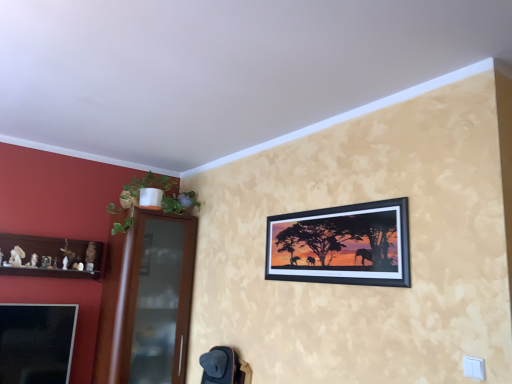
Question: Is brown glass door at left at the right side of wooden shelf at left?

Choices:
 (A) no
 (B) yes

Answer: (B)

Question: Can you confirm if brown glass door at left is positioned to the left of wooden shelf at left?

Choices:
 (A) yes
 (B) no

Answer: (B)

Question: Is brown glass door at left next to wooden shelf at left?

Choices:
 (A) no
 (B) yes

Answer: (A)

Question: Is brown glass door at left bigger than wooden shelf at left?

Choices:
 (A) yes
 (B) no

Answer: (A)

Question: From the image's perspective, is brown glass door at left over wooden shelf at left?

Choices:
 (A) yes
 (B) no

Answer: (B)

Question: Considering the relative sizes of brown glass door at left and wooden shelf at left in the image provided, is brown glass door at left wider than wooden shelf at left?

Choices:
 (A) no
 (B) yes

Answer: (B)

Question: Considering the relative positions of green leafy plant at left and wooden shelf at left in the image provided, is green leafy plant at left to the left of wooden shelf at left from the viewer's perspective?

Choices:
 (A) no
 (B) yes

Answer: (A)

Question: Is the surface of green leafy plant at left in direct contact with wooden shelf at left?

Choices:
 (A) no
 (B) yes

Answer: (A)

Question: Is the depth of green leafy plant at left greater than that of wooden shelf at left?

Choices:
 (A) no
 (B) yes

Answer: (B)

Question: Considering the relative sizes of green leafy plant at left and wooden shelf at left in the image provided, is green leafy plant at left bigger than wooden shelf at left?

Choices:
 (A) no
 (B) yes

Answer: (B)

Question: Would you say wooden shelf at left is part of green leafy plant at left's contents?

Choices:
 (A) no
 (B) yes

Answer: (A)

Question: Is green leafy plant at left aimed at wooden shelf at left?

Choices:
 (A) yes
 (B) no

Answer: (B)

Question: Is black matte picture frame at upper center oriented towards green leafy plant at left?

Choices:
 (A) yes
 (B) no

Answer: (B)